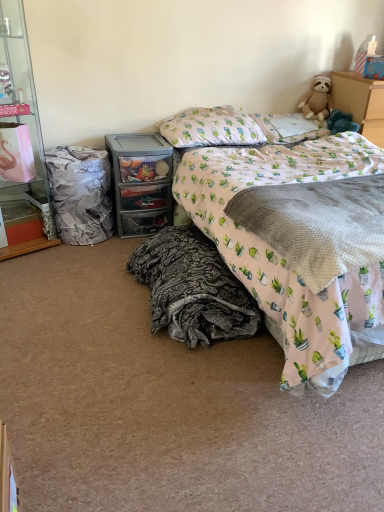
Locate an element on the screen. vacant space in front of clear plastic drawer at center, which is counted as the second chest of drawers, starting from the right is located at coordinates (106, 252).